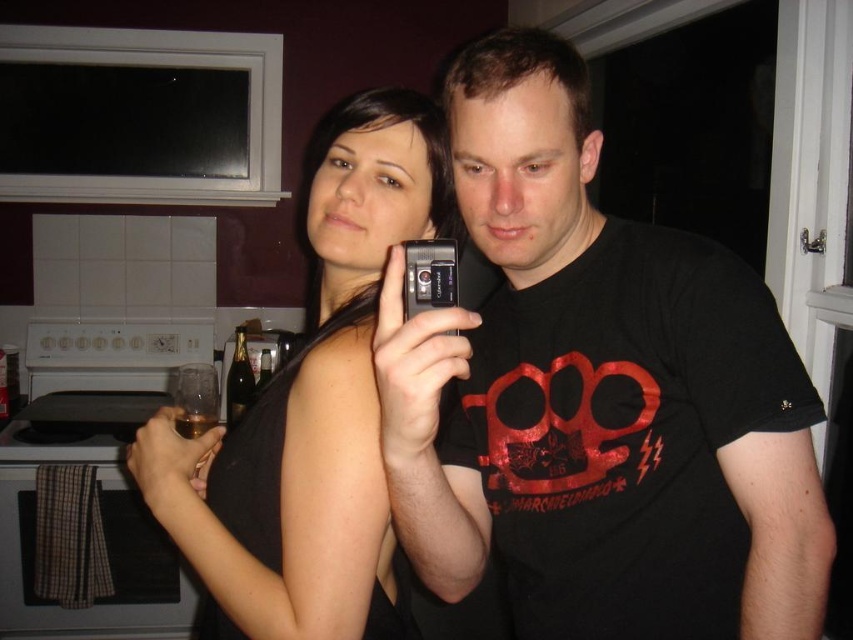
Question: Can you confirm if black matte t-shirt at center is thinner than black matte tank top at center?

Choices:
 (A) no
 (B) yes

Answer: (A)

Question: Does black matte tank top at center have a larger size compared to silver metallic camera at center?

Choices:
 (A) no
 (B) yes

Answer: (B)

Question: Which object appears farthest from the camera in this image?

Choices:
 (A) black matte tank top at center
 (B) silver metallic camera at center
 (C) shiny gold bottle at center
 (D) black matte t-shirt at center

Answer: (C)

Question: Is the position of black matte tank top at center less distant than that of shiny gold bottle at center?

Choices:
 (A) no
 (B) yes

Answer: (B)

Question: Which of the following is the closest to the observer?

Choices:
 (A) silver metallic camera at center
 (B) black matte tank top at center
 (C) black matte t-shirt at center
 (D) shiny gold bottle at center

Answer: (C)

Question: Which object appears closest to the camera in this image?

Choices:
 (A) shiny gold bottle at center
 (B) silver metallic camera at center

Answer: (B)